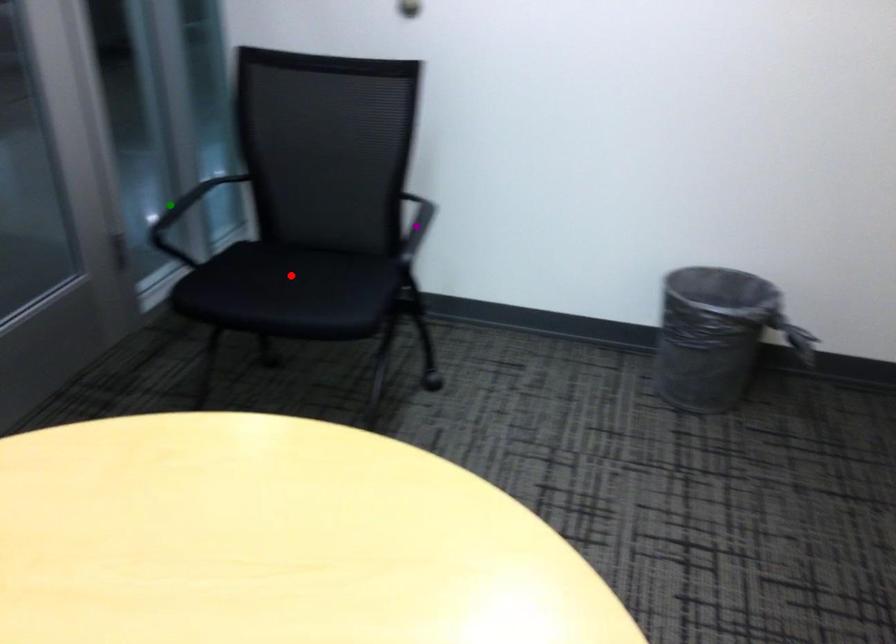
Order these from nearest to farthest:
green point, red point, purple point

1. red point
2. purple point
3. green point